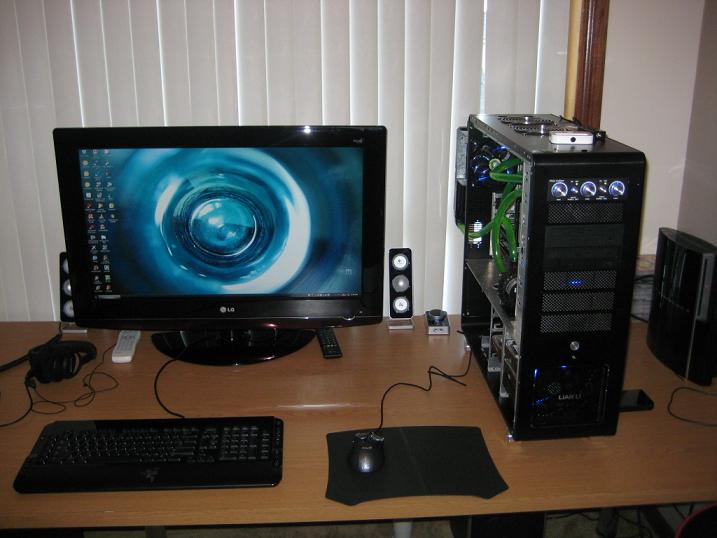
You are a GUI agent. You are given a task and a screenshot of the screen. Output one action in this format:
    pyautogui.click(x=<x>, y=<y>)
    Task: Click on the keyboard
    This screenshot has height=538, width=717.
    Given the screenshot: What is the action you would take?
    pyautogui.click(x=213, y=448)